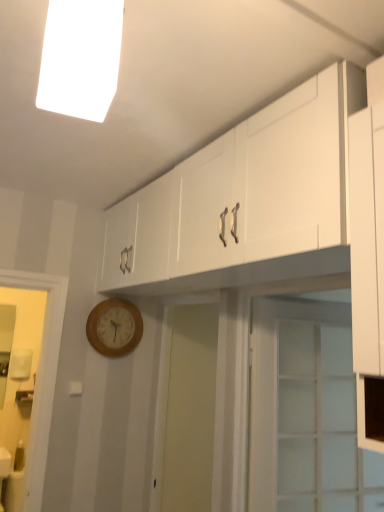
Find the location of a particular element. Image resolution: width=384 pixels, height=512 pixels. wooden wall clock at lower left is located at coordinates (114, 327).

What is the approximate height of clear glass door at center?

clear glass door at center is 37.51 inches in height.

You are a GUI agent. You are given a task and a screenshot of the screen. Output one action in this format:
    pyautogui.click(x=<x>, y=<y>)
    Task: Click on the wooden wall clock at lower left
    
    Given the screenshot: What is the action you would take?
    pyautogui.click(x=114, y=327)

Can you confirm if white fluorescent light at upper center is taller than white glossy cabinet at upper center?

No.

From the image's perspective, is white fluorescent light at upper center located above or below white glossy cabinet at upper center?

white fluorescent light at upper center is situated higher than white glossy cabinet at upper center in the image.

Where is `cabinetry on the right of white fluorescent light at upper center`? cabinetry on the right of white fluorescent light at upper center is located at coordinates (245, 191).

Is white glossy cabinet at upper center completely or partially inside white fluorescent light at upper center?

No, white glossy cabinet at upper center is not inside white fluorescent light at upper center.

From the image's perspective, is white glossy cabinet at upper center under wooden wall clock at lower left?

No, from the image's perspective, white glossy cabinet at upper center is not below wooden wall clock at lower left.

Consider the image. Is white glossy cabinet at upper center not within wooden wall clock at lower left?

Yes, white glossy cabinet at upper center is outside of wooden wall clock at lower left.

Is the depth of white glossy cabinet at upper center less than that of wooden wall clock at lower left?

Yes, white glossy cabinet at upper center is in front of wooden wall clock at lower left.

What are the coordinates of `wall clock below the white fluorescent light at upper center (from a real-world perspective)` in the screenshot? It's located at (114, 327).

From the image's perspective, would you say white fluorescent light at upper center is positioned over wooden wall clock at lower left?

Indeed, from the image's perspective, white fluorescent light at upper center is shown above wooden wall clock at lower left.

Which is in front, point (90, 32) or point (99, 303)?

Positioned in front is point (90, 32).

Does white fluorescent light at upper center turn towards wooden wall clock at lower left?

No, white fluorescent light at upper center is not oriented towards wooden wall clock at lower left.

Considering the positions of points (139, 336) and (49, 102), is point (139, 336) farther from camera compared to point (49, 102)?

Yes.

Between wooden wall clock at lower left and white fluorescent light at upper center, which one appears on the right side from the viewer's perspective?

white fluorescent light at upper center is more to the right.

From the image's perspective, does wooden wall clock at lower left appear lower than white fluorescent light at upper center?

Correct, wooden wall clock at lower left appears lower than white fluorescent light at upper center in the image.

Based on the photo, from a real-world perspective, is wooden wall clock at lower left over white fluorescent light at upper center?

No, from a real-world perspective, wooden wall clock at lower left is not above white fluorescent light at upper center.

Is point (154, 181) positioned after point (51, 44)?

Yes, it is behind point (51, 44).

From a real-world perspective, is white glossy cabinet at upper center on top of white fluorescent light at upper center?

Actually, white glossy cabinet at upper center is physically below white fluorescent light at upper center in the real world.

Considering the positions of objects white glossy cabinet at upper center and white fluorescent light at upper center in the image provided, who is behind, white glossy cabinet at upper center or white fluorescent light at upper center?

white glossy cabinet at upper center is more distant.

Who is shorter, white glossy cabinet at upper center or white fluorescent light at upper center?

Standing shorter between the two is white fluorescent light at upper center.

Does white fluorescent light at upper center have a smaller size compared to clear glass door at center?

Correct, white fluorescent light at upper center occupies less space than clear glass door at center.

From the picture: Which point is more forward, (x=56, y=69) or (x=250, y=387)?

Point (x=56, y=69)

Is white fluorescent light at upper center turned away from clear glass door at center?

No.

Is clear glass door at center inside white fluorescent light at upper center?

No, clear glass door at center is not inside white fluorescent light at upper center.

Which object is further away from the camera taking this photo, clear glass door at center or wooden wall clock at lower left?

wooden wall clock at lower left is further from the camera.

Looking at the image, does clear glass door at center seem bigger or smaller compared to wooden wall clock at lower left?

Clearly, clear glass door at center is larger in size than wooden wall clock at lower left.

Based on the photo, considering the relative sizes of clear glass door at center and wooden wall clock at lower left in the image provided, is clear glass door at center thinner than wooden wall clock at lower left?

No, clear glass door at center is not thinner than wooden wall clock at lower left.

Could you tell me if clear glass door at center is turned towards wooden wall clock at lower left?

No.

You are a GUI agent. You are given a task and a screenshot of the screen. Output one action in this format:
    pyautogui.click(x=<x>, y=<y>)
    Task: Click on the cabinetry below the white fluorescent light at upper center (from the image's perspective)
    
    Given the screenshot: What is the action you would take?
    pyautogui.click(x=245, y=191)

The height and width of the screenshot is (512, 384). Identify the location of cabinetry located above the wooden wall clock at lower left (from a real-world perspective). (245, 191).

Looking at the image, which one is located closer to white fluorescent light at upper center, clear glass door at center or white glossy cabinet at upper center?

Based on the image, white glossy cabinet at upper center appears to be nearer to white fluorescent light at upper center.

From the image, which object appears to be farther from white glossy cabinet at upper center, white fluorescent light at upper center or clear glass door at center?

clear glass door at center is positioned further to the anchor white glossy cabinet at upper center.

Which object lies nearer to the anchor point wooden wall clock at lower left, clear glass door at center or white fluorescent light at upper center?

clear glass door at center.

When comparing their distances from clear glass door at center, does wooden wall clock at lower left or white glossy cabinet at upper center seem further?

Among the two, wooden wall clock at lower left is located further to clear glass door at center.

Considering their positions, is clear glass door at center positioned closer to wooden wall clock at lower left than white glossy cabinet at upper center?

Based on the image, white glossy cabinet at upper center appears to be nearer to wooden wall clock at lower left.

Which object lies further to the anchor point white glossy cabinet at upper center, clear glass door at center or wooden wall clock at lower left?

wooden wall clock at lower left.

Considering their positions, is white glossy cabinet at upper center positioned further to wooden wall clock at lower left than white fluorescent light at upper center?

Based on the image, white fluorescent light at upper center appears to be further to wooden wall clock at lower left.

Looking at the image, which one is located further to white fluorescent light at upper center, white glossy cabinet at upper center or wooden wall clock at lower left?

wooden wall clock at lower left is positioned further to the anchor white fluorescent light at upper center.

You are a GUI agent. You are given a task and a screenshot of the screen. Output one action in this format:
    pyautogui.click(x=<x>, y=<y>)
    Task: Click on the door between white glossy cabinet at upper center and wooden wall clock at lower left in the front-back direction
    This screenshot has width=384, height=512.
    Given the screenshot: What is the action you would take?
    [306, 412]

Locate an element on the screen. door between white fluorescent light at upper center and wooden wall clock at lower left in the front-back direction is located at coordinates (306, 412).

This screenshot has width=384, height=512. I want to click on cabinetry between white fluorescent light at upper center and clear glass door at center from top to bottom, so click(245, 191).

Identify the location of cabinetry located between white fluorescent light at upper center and wooden wall clock at lower left in the depth direction. (245, 191).